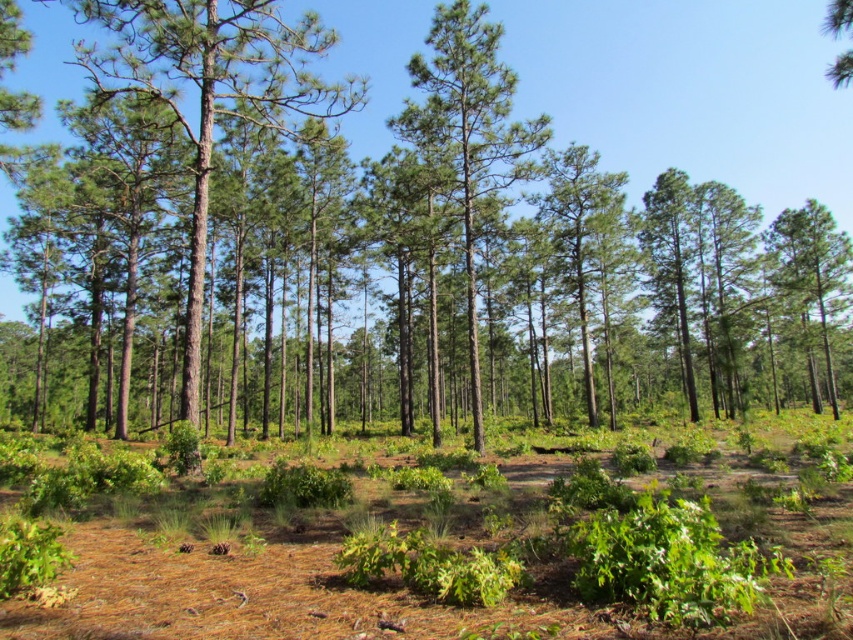
You are standing in the forest and want to touch both the green textured tree at center and the green rough bark tree at center. Which tree should you approach first to reach the closer one?

You should approach the green textured tree at center first because it is closer to you than the green rough bark tree at center.

You are an environmental scientist studying the forest structure. You observe the green textured tree at center and the green matte tree at right. Which tree would cast a longer shadow during midday when the sun is directly overhead?

The green textured tree at center casts a longer shadow because it has a greater height compared to the green matte tree at right.

You are a hiker who wants to identify the wider tree between the green rough bark tree at center and the green matte tree at center. Which one should you choose?

The green rough bark tree at center is wider than the green matte tree at center, so you should choose the green rough bark tree at center.